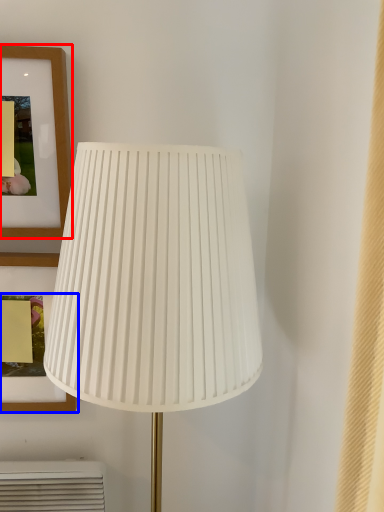
Question: Which point is further to the camera, picture frame (highlighted by a red box) or picture frame (highlighted by a blue box)?

Choices:
 (A) picture frame
 (B) picture frame

Answer: (B)